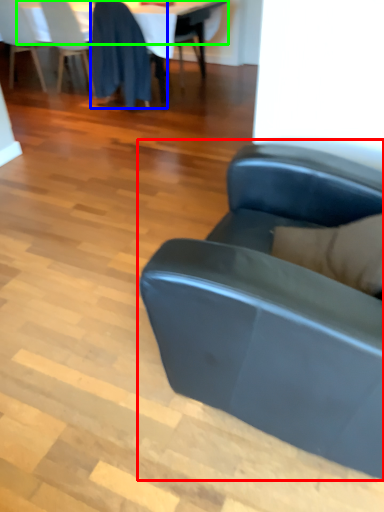
Question: Which object is the closest to the studio couch (highlighted by a red box)? Choose among these: chair (highlighted by a blue box) or table top (highlighted by a green box).

Choices:
 (A) chair
 (B) table top

Answer: (A)